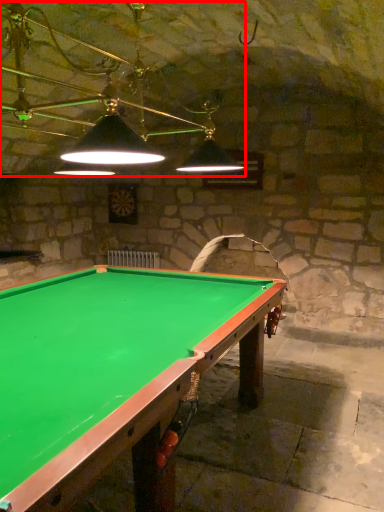
Question: In this image, where is lamp (annotated by the red box) located relative to billiard table?

Choices:
 (A) right
 (B) left

Answer: (B)